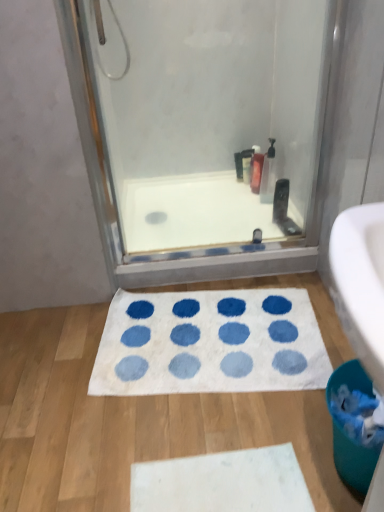
Question: Is transparent glass shower door at upper center in front of teal plastic toilet bowl at lower right?

Choices:
 (A) yes
 (B) no

Answer: (B)

Question: From the image's perspective, is transparent glass shower door at upper center on teal plastic toilet bowl at lower right?

Choices:
 (A) no
 (B) yes

Answer: (B)

Question: Is transparent glass shower door at upper center oriented towards teal plastic toilet bowl at lower right?

Choices:
 (A) no
 (B) yes

Answer: (B)

Question: Does transparent glass shower door at upper center have a lesser width compared to teal plastic toilet bowl at lower right?

Choices:
 (A) no
 (B) yes

Answer: (B)

Question: Considering the relative positions of transparent glass shower door at upper center and teal plastic toilet bowl at lower right in the image provided, is transparent glass shower door at upper center to the left of teal plastic toilet bowl at lower right from the viewer's perspective?

Choices:
 (A) no
 (B) yes

Answer: (B)

Question: Would you say transparent glass shower door at upper center is to the left or to the right of matte black bottle at upper center in the picture?

Choices:
 (A) right
 (B) left

Answer: (B)

Question: From a real-world perspective, is transparent glass shower door at upper center physically located above or below matte black bottle at upper center?

Choices:
 (A) below
 (B) above

Answer: (B)

Question: Based on their sizes in the image, would you say transparent glass shower door at upper center is bigger or smaller than matte black bottle at upper center?

Choices:
 (A) big
 (B) small

Answer: (A)

Question: Is transparent glass shower door at upper center wider or thinner than matte black bottle at upper center?

Choices:
 (A) thin
 (B) wide

Answer: (A)

Question: From a real-world perspective, is matte black bottle at upper center physically located above or below white smooth bathtub at center?

Choices:
 (A) above
 (B) below

Answer: (A)

Question: Considering the positions of matte black bottle at upper center and white smooth bathtub at center in the image, is matte black bottle at upper center wider or thinner than white smooth bathtub at center?

Choices:
 (A) wide
 (B) thin

Answer: (B)

Question: In the image, is matte black bottle at upper center positioned in front of or behind white smooth bathtub at center?

Choices:
 (A) behind
 (B) front

Answer: (A)

Question: In terms of size, does matte black bottle at upper center appear bigger or smaller than white smooth bathtub at center?

Choices:
 (A) big
 (B) small

Answer: (B)

Question: Choose the correct answer: Is white soft bath mat at center inside transparent glass shower door at upper center or outside it?

Choices:
 (A) outside
 (B) inside

Answer: (A)

Question: Considering their positions, is white soft bath mat at center located in front of or behind transparent glass shower door at upper center?

Choices:
 (A) front
 (B) behind

Answer: (B)